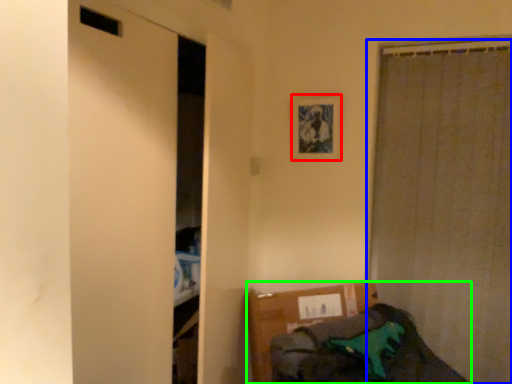
Question: Which is farther away from picture frame (highlighted by a red box)? curtain (highlighted by a blue box) or furniture (highlighted by a green box)?

Choices:
 (A) curtain
 (B) furniture

Answer: (B)